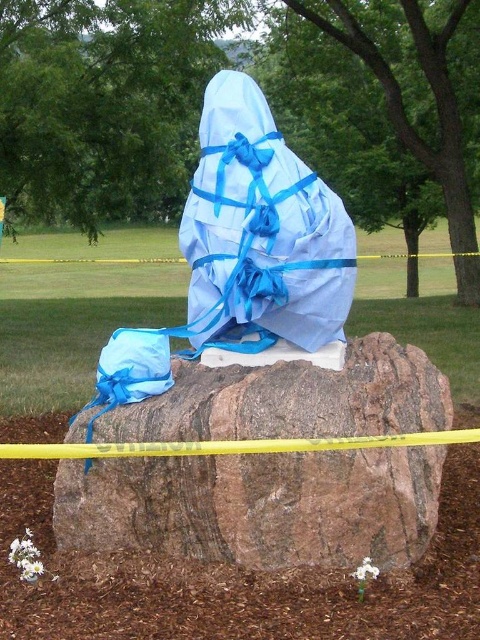
Question: Does brown rough rock at center have a larger size compared to blue fabric bag at center?

Choices:
 (A) yes
 (B) no

Answer: (A)

Question: From the image, what is the correct spatial relationship of brown rough rock at center in relation to blue fabric bag at center?

Choices:
 (A) left
 (B) right

Answer: (B)

Question: Does brown rough rock at center have a lesser width compared to blue fabric bag at center?

Choices:
 (A) no
 (B) yes

Answer: (A)

Question: Which point is farther to the camera?

Choices:
 (A) (69, 541)
 (B) (302, 202)

Answer: (B)